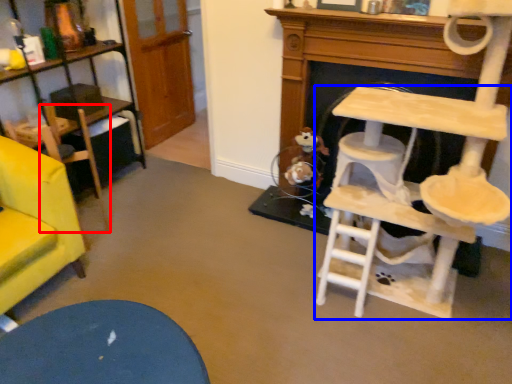
Question: Which object is further to the camera taking this photo, armchair (highlighted by a red box) or table (highlighted by a blue box)?

Choices:
 (A) armchair
 (B) table

Answer: (A)